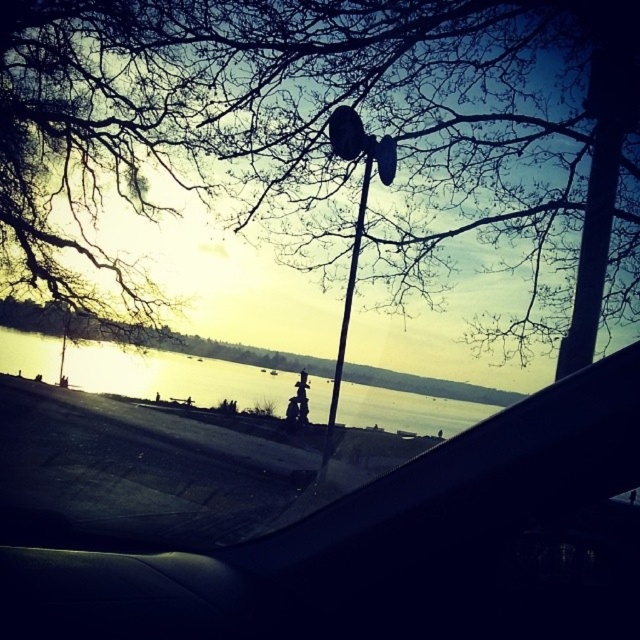
You are a photographer trying to capture the entire scene through the car windshield. Given that the bare branches at upper center and the matte black lamp post at center are both in your view, which object would require you to adjust your camera angle more to ensure they are fully captured?

The bare branches at upper center would require adjusting the camera angle more because they are wider than the matte black lamp post at center.

You are a photographer inside the car and want to capture the entire scene through the windshield. Given that the matte black lamp post at center is narrower than the silvery reflective water at center, will the lamp post fit entirely within the water reflection area?

The silvery reflective water at center is wider than the matte black lamp post at center, so yes, the matte black lamp post at center will fit entirely within the silvery reflective water at center.

You are a photographer standing inside the car, and you want to capture a photo where both the bare branches at upper center and the silvery reflective water at center are in focus. If your camera can only focus on objects within a 2.5 meter range, will you be able to achieve this?

The distance between the bare branches at upper center and the silvery reflective water at center is 3.60 meters. Since your camera can only focus within a 2.5 meter range, the objects are too far apart for both to be in focus simultaneously.